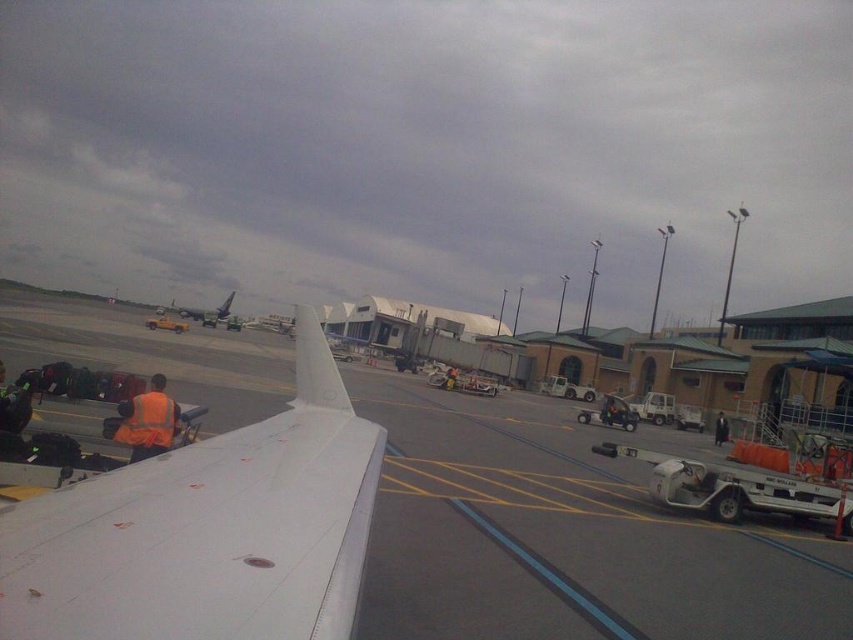
You are a passenger sitting in the front row of an airplane. You look out the window and see the white matte wing at lower left and the orange reflective vest at center. Which object is closer to the window?

The orange reflective vest at center is closer to the window because the white matte wing at lower left is located above it, meaning the vest is in front of the wing and thus nearer to the observer.

You are a passenger sitting near the window and see the white matte wing at lower left and the orange reflective vest at center. Which object is closer to the left edge of the window?

The white matte wing at lower left is closer to the left edge of the window because it is positioned on the left side of the orange reflective vest at center.

From the picture: You are a pilot preparing for takeoff and need to ensure there are no obstructions between your aircraft and the runway. You notice an orange reflective vest at lower left and a metallic gray airplane at center. Based on their distance, can you safely proceed with takeoff?

The orange reflective vest at lower left and metallic gray airplane at center are 351.60 feet apart from each other. Since the distance between them is sufficient, you can safely proceed with takeoff.